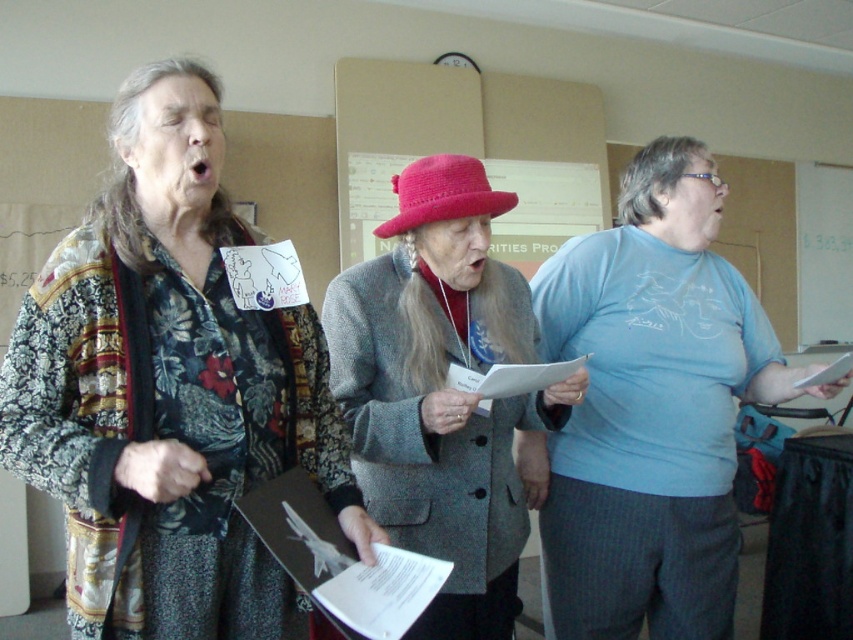
Question: Which point is farther to the camera?

Choices:
 (A) pink woolen hat at center
 (B) light blue t-shirt at center

Answer: (B)

Question: Does light blue t-shirt at center have a larger size compared to gray wool coat at center?

Choices:
 (A) no
 (B) yes

Answer: (B)

Question: Which object is positioned closest to the floral fabric shirt at left?

Choices:
 (A) pink woolen hat at center
 (B) gray wool coat at center
 (C) light blue t-shirt at center

Answer: (B)

Question: Based on their relative distances, which object is nearer to the gray wool coat at center?

Choices:
 (A) light blue t-shirt at center
 (B) pink woolen hat at center
 (C) floral fabric shirt at left

Answer: (B)

Question: Does gray wool coat at center appear on the right side of pink woolen hat at center?

Choices:
 (A) no
 (B) yes

Answer: (B)

Question: Does floral fabric shirt at left come in front of gray wool coat at center?

Choices:
 (A) no
 (B) yes

Answer: (B)